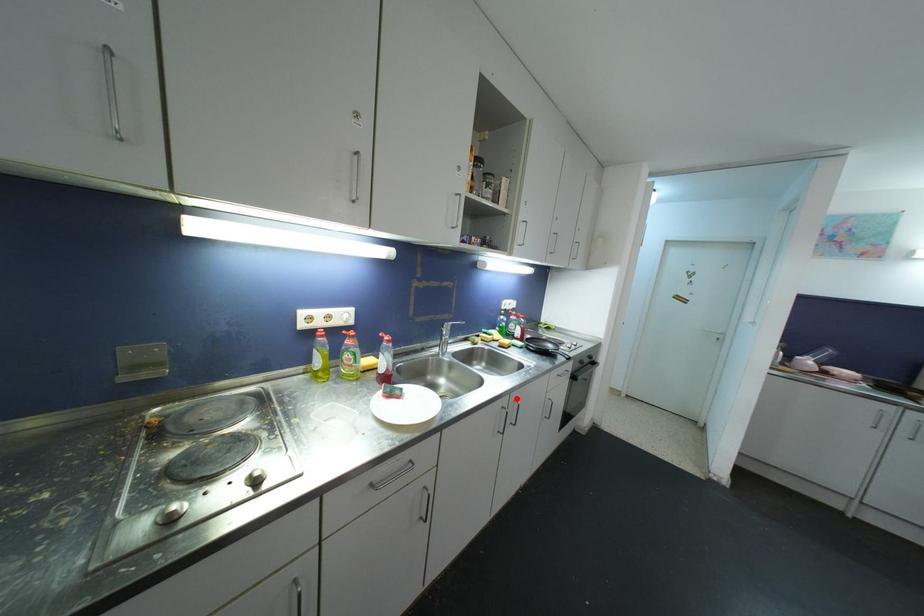
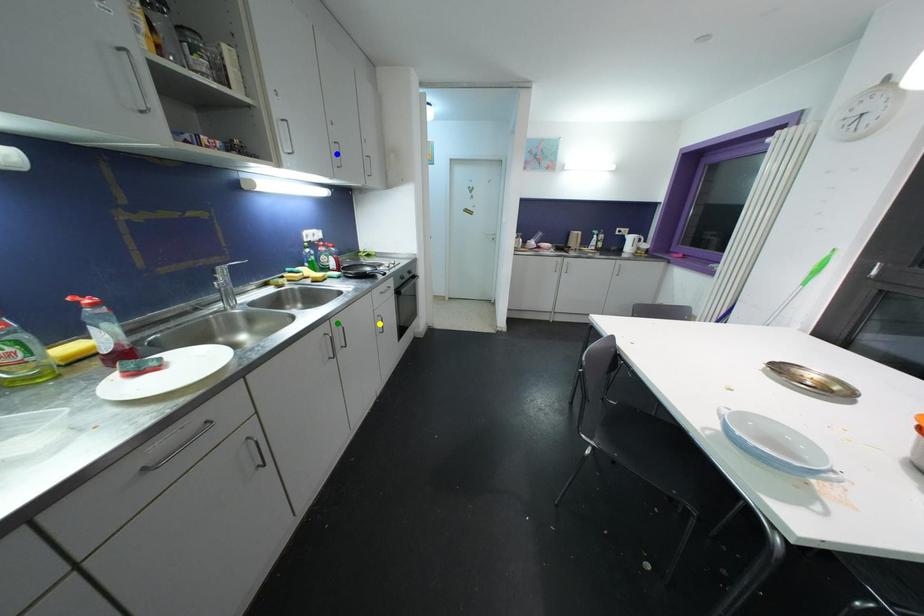
Question: I am providing you with two images of the same scene from different viewpoints. A red point is marked on the first image. You are given multiple points on the second image. Can you choose the point in image 2 that corresponds to the point in image 1?

Choices:
 (A) yellow point
 (B) green point
 (C) blue point

Answer: (B)